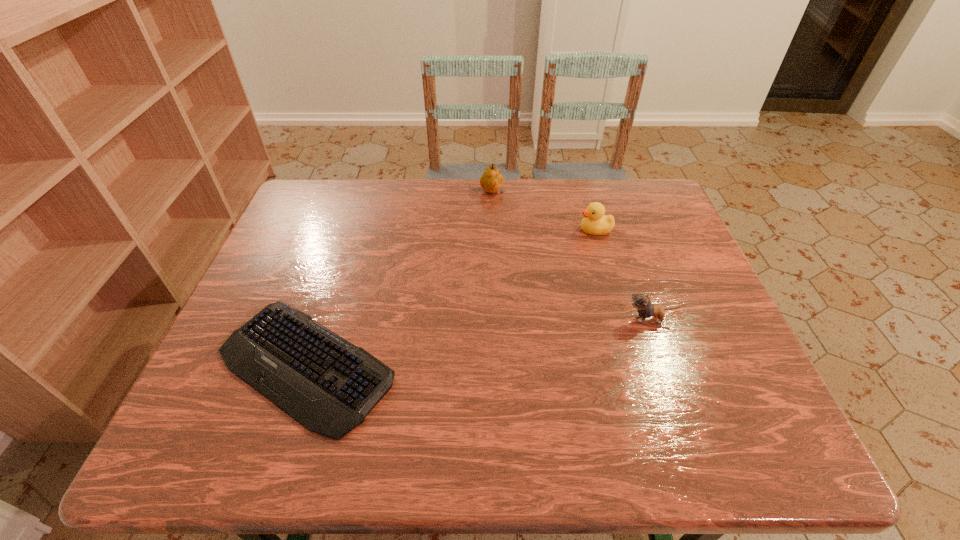
Locate an element on the screen. The height and width of the screenshot is (540, 960). pear is located at coordinates (491, 181).

Where is `the farthest object`? The height and width of the screenshot is (540, 960). the farthest object is located at coordinates (491, 181).

Locate an element on the screen. Image resolution: width=960 pixels, height=540 pixels. duck is located at coordinates (x=594, y=222).

Locate an element on the screen. kitten is located at coordinates (642, 303).

You are a GUI agent. You are given a task and a screenshot of the screen. Output one action in this format:
    pyautogui.click(x=<x>, y=<y>)
    Task: Click on the shortest object
    This screenshot has height=540, width=960.
    Given the screenshot: What is the action you would take?
    pyautogui.click(x=329, y=385)

At what (x,y) coordinates should I click in order to perform the action: click on the leftmost object. Please return your answer as a coordinate pair (x, y). The image size is (960, 540). Looking at the image, I should click on (329, 385).

You are a GUI agent. You are given a task and a screenshot of the screen. Output one action in this format:
    pyautogui.click(x=<x>, y=<y>)
    Task: Click on the vacant point located on the left of the farthest object
    The width and height of the screenshot is (960, 540).
    Given the screenshot: What is the action you would take?
    pyautogui.click(x=420, y=193)

Where is `blank area located at the beak of the duck`? blank area located at the beak of the duck is located at coordinates coord(540,230).

The width and height of the screenshot is (960, 540). What are the coordinates of `vacant space located at the beak of the duck` in the screenshot? It's located at (508, 230).

Identify the location of free space located 0.180m at the beak of the duck. The height and width of the screenshot is (540, 960). (515, 230).